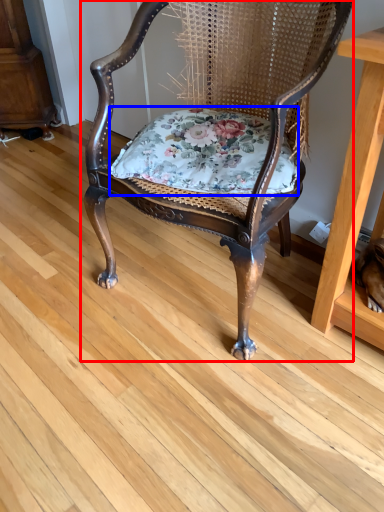
Question: Which object appears closest to the camera in this image, chair (highlighted by a red box) or blanket (highlighted by a blue box)?

Choices:
 (A) chair
 (B) blanket

Answer: (A)